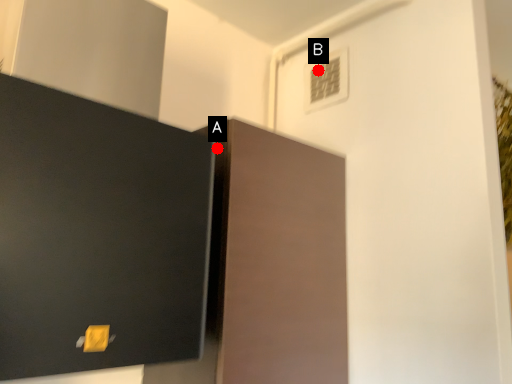
Question: Two points are circled on the image, labeled by A and B beside each circle. Which point appears closest to the camera in this image?

Choices:
 (A) A is closer
 (B) B is closer

Answer: (A)